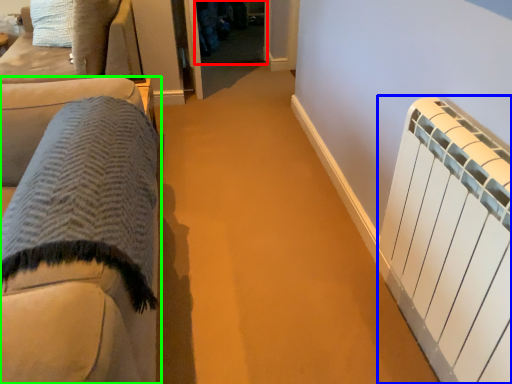
Question: Which object is the closest to the glass door (highlighted by a red box)? Choose among these: radiator (highlighted by a blue box) or furniture (highlighted by a green box).

Choices:
 (A) radiator
 (B) furniture

Answer: (B)